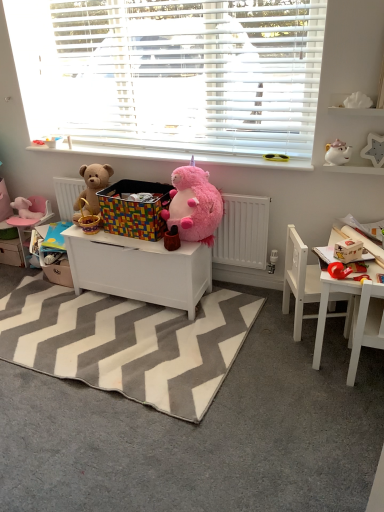
Question: From the image's perspective, is white plastic sunglasses at upper center on white matte toy chest at center, placed as the 1th table when sorted from left to right?

Choices:
 (A) no
 (B) yes

Answer: (B)

Question: Is white matte toy chest at center, placed as the 1th table when sorted from left to right, at the back of white plastic sunglasses at upper center?

Choices:
 (A) yes
 (B) no

Answer: (B)

Question: Considering the relative sizes of white plastic sunglasses at upper center and white matte toy chest at center, placed as the 1th table when sorted from left to right, in the image provided, is white plastic sunglasses at upper center bigger than white matte toy chest at center, placed as the 1th table when sorted from left to right,?

Choices:
 (A) no
 (B) yes

Answer: (A)

Question: Is white plastic sunglasses at upper center far from white matte toy chest at center, placed as the 1th table when sorted from left to right?

Choices:
 (A) yes
 (B) no

Answer: (B)

Question: Considering the relative positions of white plastic sunglasses at upper center and white matte toy chest at center, which is the 2th table from right to left, in the image provided, is white plastic sunglasses at upper center to the left of white matte toy chest at center, which is the 2th table from right to left, from the viewer's perspective?

Choices:
 (A) no
 (B) yes

Answer: (A)

Question: Is white glossy teapot at upper right, the third toy viewed from the front, wider or thinner than white wooden chair at lower right, the second chair when ordered from front to back?

Choices:
 (A) thin
 (B) wide

Answer: (A)

Question: In terms of size, does white glossy teapot at upper right, the 3th toy in the back-to-front sequence, appear bigger or smaller than white wooden chair at lower right, positioned as the 1th chair in back-to-front order?

Choices:
 (A) small
 (B) big

Answer: (A)

Question: Is white glossy teapot at upper right, the 3th toy in the back-to-front sequence, in front of or behind white wooden chair at lower right, positioned as the 1th chair in back-to-front order, in the image?

Choices:
 (A) front
 (B) behind

Answer: (B)

Question: From the image's perspective, is white glossy teapot at upper right, the 3th toy in the back-to-front sequence, above or below white wooden chair at lower right, the second chair when ordered from front to back?

Choices:
 (A) above
 (B) below

Answer: (A)

Question: From the image's perspective, is gray zigzag rug at center positioned above or below shiny yellow sunglasses at upper center, the 2th toy when ordered from back to front?

Choices:
 (A) above
 (B) below

Answer: (B)

Question: Would you say gray zigzag rug at center is inside or outside shiny yellow sunglasses at upper center, the 4th toy viewed from the front?

Choices:
 (A) inside
 (B) outside

Answer: (B)

Question: Visually, is gray zigzag rug at center positioned to the left or to the right of shiny yellow sunglasses at upper center, the 2th toy when ordered from back to front?

Choices:
 (A) left
 (B) right

Answer: (A)

Question: Does point (175, 366) appear closer or farther from the camera than point (271, 156)?

Choices:
 (A) farther
 (B) closer

Answer: (B)

Question: Relative to white glossy teapot at upper right, acting as the 3th toy starting from the left, is gray zigzag rug at center in front or behind?

Choices:
 (A) front
 (B) behind

Answer: (A)

Question: Considering the positions of gray zigzag rug at center and white glossy teapot at upper right, the third toy viewed from the front, in the image, is gray zigzag rug at center taller or shorter than white glossy teapot at upper right, the third toy viewed from the front,?

Choices:
 (A) tall
 (B) short

Answer: (B)